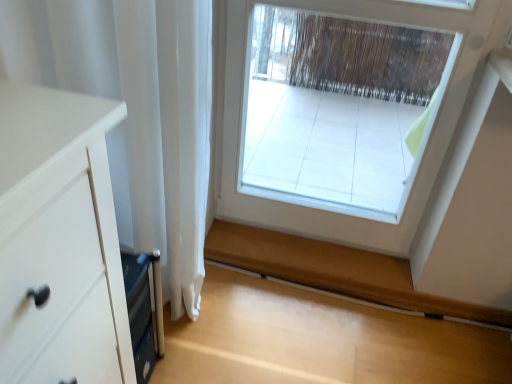
Where is `white glossy door at center`? Image resolution: width=512 pixels, height=384 pixels. white glossy door at center is located at coordinates (423, 138).

The height and width of the screenshot is (384, 512). Describe the element at coordinates (423, 138) in the screenshot. I see `white glossy door at center` at that location.

Where is `white glossy door at center`? The height and width of the screenshot is (384, 512). white glossy door at center is located at coordinates (423, 138).